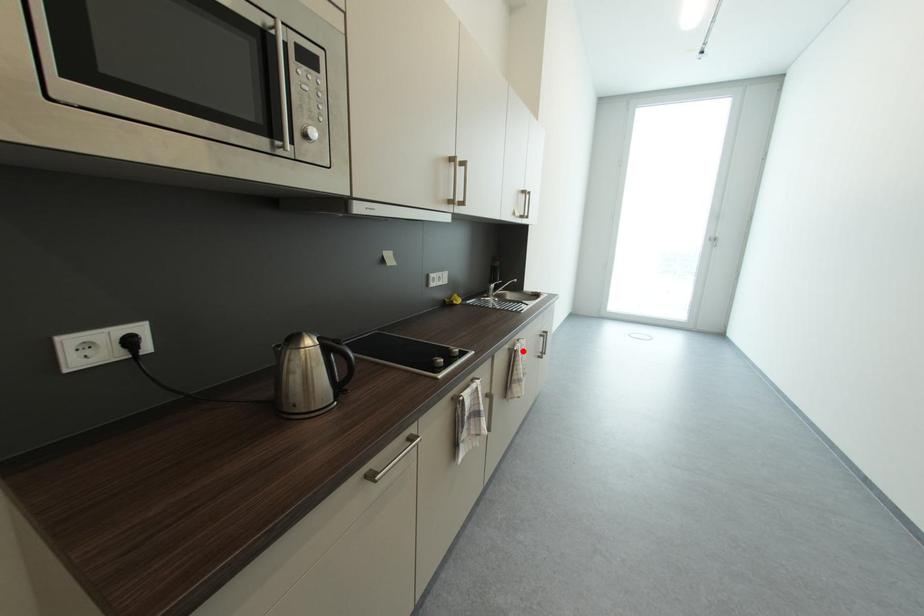
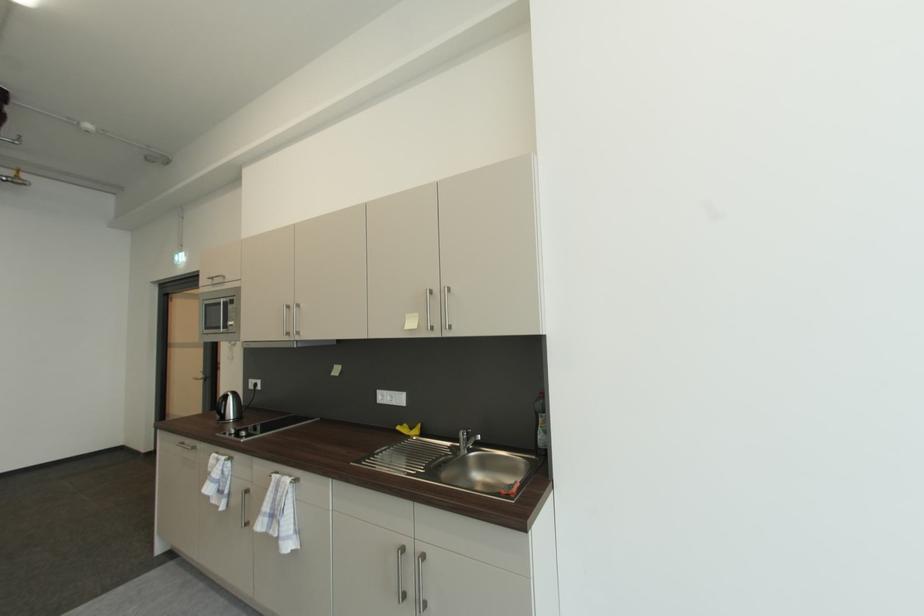
The point at the highlighted location is marked in the first image. Where is the corresponding point in the second image?

(277, 477)